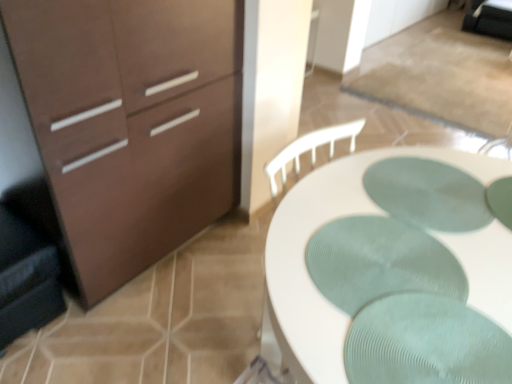
What do you see at coordinates (428, 194) in the screenshot? The width and height of the screenshot is (512, 384). I see `green textured placemat at center, which appears as the first oval when viewed from the top` at bounding box center [428, 194].

Locate an element on the screen. The width and height of the screenshot is (512, 384). green textured placemat at center, the 2th oval viewed from the front is located at coordinates (428, 194).

Find the location of `green ribbed placemat at center, the 1th oval positioned from the bottom`. green ribbed placemat at center, the 1th oval positioned from the bottom is located at coordinates (379, 262).

Locate an element on the screen. The height and width of the screenshot is (384, 512). green textured placemat at center, marked as the 2th oval in a bottom-to-top arrangement is located at coordinates tap(428, 194).

From the image's perspective, which is below, white textured desk at center or green ribbed placemat at center, which is the 2th oval in back-to-front order?

white textured desk at center, from the image's perspective.

Does white textured desk at center turn towards green ribbed placemat at center, which is the 2th oval in back-to-front order?

No, white textured desk at center is not aimed at green ribbed placemat at center, which is the 2th oval in back-to-front order.

From a real-world perspective, is white textured desk at center positioned above or below green ribbed placemat at center, which is the 2th oval in back-to-front order?

white textured desk at center is situated lower than green ribbed placemat at center, which is the 2th oval in back-to-front order, in the real world.

Is white textured desk at center wider than green ribbed placemat at center, which is the 2th oval in back-to-front order?

Correct, the width of white textured desk at center exceeds that of green ribbed placemat at center, which is the 2th oval in back-to-front order.

How far apart are green textured placemat at center, marked as the 2th oval in a bottom-to-top arrangement, and matte brown cabinet at left?

green textured placemat at center, marked as the 2th oval in a bottom-to-top arrangement, is 34.96 inches away from matte brown cabinet at left.

Considering the relative sizes of green textured placemat at center, marked as the 2th oval in a bottom-to-top arrangement, and matte brown cabinet at left in the image provided, is green textured placemat at center, marked as the 2th oval in a bottom-to-top arrangement, shorter than matte brown cabinet at left?

Correct, green textured placemat at center, marked as the 2th oval in a bottom-to-top arrangement, is not as tall as matte brown cabinet at left.

Is green textured placemat at center, the 2th oval viewed from the front, at the left side of matte brown cabinet at left?

Incorrect, green textured placemat at center, the 2th oval viewed from the front, is not on the left side of matte brown cabinet at left.

Considering the sizes of green textured placemat at center, which appears as the first oval when viewed from the top, and matte brown cabinet at left in the image, is green textured placemat at center, which appears as the first oval when viewed from the top, wider or thinner than matte brown cabinet at left?

green textured placemat at center, which appears as the first oval when viewed from the top, is thinner than matte brown cabinet at left.

Considering the sizes of objects green ribbed placemat at center, the second oval from the top, and dark gray fabric swivel chair at left in the image provided, who is thinner, green ribbed placemat at center, the second oval from the top, or dark gray fabric swivel chair at left?

With smaller width is green ribbed placemat at center, the second oval from the top.

Considering the positions of objects green ribbed placemat at center, arranged as the 1th oval when viewed from the front, and dark gray fabric swivel chair at left in the image provided, who is in front, green ribbed placemat at center, arranged as the 1th oval when viewed from the front, or dark gray fabric swivel chair at left?

green ribbed placemat at center, arranged as the 1th oval when viewed from the front, is closer to the camera.

From a real-world perspective, does green ribbed placemat at center, which is the 2th oval in back-to-front order, stand above dark gray fabric swivel chair at left?

Indeed, from a real-world perspective, green ribbed placemat at center, which is the 2th oval in back-to-front order, stands above dark gray fabric swivel chair at left.

From the image's perspective, is green ribbed placemat at center, the 1th oval positioned from the bottom, located beneath matte brown cabinet at left?

Yes, from the image's perspective, green ribbed placemat at center, the 1th oval positioned from the bottom, is below matte brown cabinet at left.

From a real-world perspective, relative to matte brown cabinet at left, is green ribbed placemat at center, which is the 2th oval in back-to-front order, vertically above or below?

green ribbed placemat at center, which is the 2th oval in back-to-front order, is situated higher than matte brown cabinet at left in the real world.

From the picture: Could you tell me if green ribbed placemat at center, arranged as the 1th oval when viewed from the front, is facing matte brown cabinet at left?

No, green ribbed placemat at center, arranged as the 1th oval when viewed from the front, is not aimed at matte brown cabinet at left.

Is green ribbed placemat at center, the 1th oval positioned from the bottom, closer to the viewer compared to matte brown cabinet at left?

Yes, green ribbed placemat at center, the 1th oval positioned from the bottom, is closer to the camera.

Who is smaller, green textured placemat at center, positioned as the first oval in back-to-front order, or green ribbed placemat at center, arranged as the 1th oval when viewed from the front?

green textured placemat at center, positioned as the first oval in back-to-front order, is smaller.

Considering the positions of points (472, 213) and (344, 282), is point (472, 213) farther from camera compared to point (344, 282)?

Yes, it is behind point (344, 282).

From the image's perspective, which object appears higher, green textured placemat at center, the 2th oval viewed from the front, or green ribbed placemat at center, which is the 2th oval in back-to-front order?

green textured placemat at center, the 2th oval viewed from the front, appears higher in the image.

Is green textured placemat at center, which appears as the first oval when viewed from the top, oriented away from green ribbed placemat at center, the 1th oval positioned from the bottom?

No, green textured placemat at center, which appears as the first oval when viewed from the top, is not facing the opposite direction of green ribbed placemat at center, the 1th oval positioned from the bottom.

How many degrees apart are the facing directions of white textured desk at center and matte brown cabinet at left?

3.62e-06 degrees separate the facing orientations of white textured desk at center and matte brown cabinet at left.

Between white textured desk at center and matte brown cabinet at left, which one has smaller width?

white textured desk at center is thinner.

Between white textured desk at center and matte brown cabinet at left, which one has less height?

Standing shorter between the two is white textured desk at center.

Is matte brown cabinet at left thinner than white textured desk at center?

No.

Is point (143, 106) farther from viewer compared to point (511, 268)?

Yes, it is behind point (511, 268).

Consider the image. From the image's perspective, is matte brown cabinet at left below white textured desk at center?

Incorrect, from the image's perspective, matte brown cabinet at left is higher than white textured desk at center.

Locate an element on the screen. The height and width of the screenshot is (384, 512). desk below the green ribbed placemat at center, which is the 2th oval in back-to-front order (from the image's perspective) is located at coordinates (308, 239).

You are a GUI agent. You are given a task and a screenshot of the screen. Output one action in this format:
    pyautogui.click(x=<x>, y=<y>)
    Task: Click on the chest of drawers lying in front of the green textured placemat at center, positioned as the first oval in back-to-front order
    This screenshot has height=384, width=512.
    Given the screenshot: What is the action you would take?
    pyautogui.click(x=131, y=123)

Looking at this image, looking at the image, which one is located further to dark gray fabric swivel chair at left, matte brown cabinet at left or green textured placemat at center, the 2th oval viewed from the front?

green textured placemat at center, the 2th oval viewed from the front, lies further to dark gray fabric swivel chair at left than the other object.

Considering their positions, is green ribbed placemat at center, arranged as the 1th oval when viewed from the front, positioned closer to green textured placemat at center, marked as the 2th oval in a bottom-to-top arrangement, than matte brown cabinet at left?

Among the two, green ribbed placemat at center, arranged as the 1th oval when viewed from the front, is located nearer to green textured placemat at center, marked as the 2th oval in a bottom-to-top arrangement.

Which object lies further to the anchor point green textured placemat at center, the 2th oval viewed from the front, dark gray fabric swivel chair at left or white textured desk at center?

Among the two, dark gray fabric swivel chair at left is located further to green textured placemat at center, the 2th oval viewed from the front.

From the image, which object appears to be nearer to green ribbed placemat at center, the 1th oval positioned from the bottom, white textured desk at center or matte brown cabinet at left?

Among the two, white textured desk at center is located nearer to green ribbed placemat at center, the 1th oval positioned from the bottom.

From the image, which object appears to be nearer to dark gray fabric swivel chair at left, green textured placemat at center, positioned as the first oval in back-to-front order, or matte brown cabinet at left?

The object closer to dark gray fabric swivel chair at left is matte brown cabinet at left.

Considering their positions, is green textured placemat at center, which appears as the first oval when viewed from the top, positioned further to white textured desk at center than dark gray fabric swivel chair at left?

dark gray fabric swivel chair at left.

Which object lies further to the anchor point green ribbed placemat at center, which is the 2th oval in back-to-front order, dark gray fabric swivel chair at left or white textured desk at center?

dark gray fabric swivel chair at left is further to green ribbed placemat at center, which is the 2th oval in back-to-front order.

Considering their positions, is white textured desk at center positioned closer to dark gray fabric swivel chair at left than matte brown cabinet at left?

matte brown cabinet at left is closer to dark gray fabric swivel chair at left.

Where is `desk between dark gray fabric swivel chair at left and green textured placemat at center, which appears as the first oval when viewed from the top, in the horizontal direction`? This screenshot has height=384, width=512. desk between dark gray fabric swivel chair at left and green textured placemat at center, which appears as the first oval when viewed from the top, in the horizontal direction is located at coordinates (308, 239).

You are a GUI agent. You are given a task and a screenshot of the screen. Output one action in this format:
    pyautogui.click(x=<x>, y=<y>)
    Task: Click on the desk between matte brown cabinet at left and green textured placemat at center, marked as the 2th oval in a bottom-to-top arrangement, from left to right
    The height and width of the screenshot is (384, 512).
    Given the screenshot: What is the action you would take?
    pyautogui.click(x=308, y=239)

In order to click on the chest of drawers located between dark gray fabric swivel chair at left and green ribbed placemat at center, the second oval from the top, in the left-right direction in this screenshot , I will do `click(131, 123)`.

Locate an element on the screen. Image resolution: width=512 pixels, height=384 pixels. oval located between dark gray fabric swivel chair at left and green textured placemat at center, positioned as the first oval in back-to-front order, in the left-right direction is located at coordinates (379, 262).